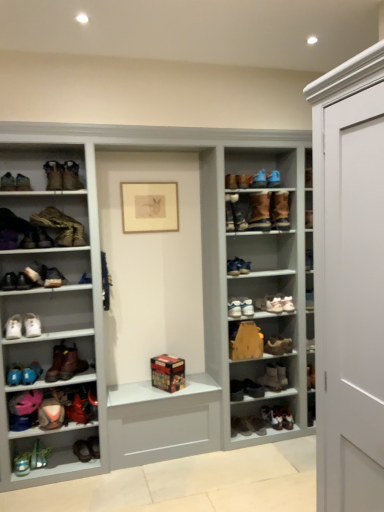
The image size is (384, 512). I want to click on free space above brown leather boot at lower left, the twelfth footwear when ordered from top to bottom (from a real-world perspective), so click(x=61, y=347).